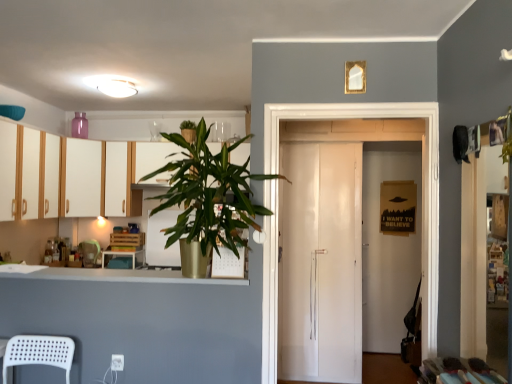
Question: Could you tell me if matte wood table at center is turned towards white glossy refrigerator at center?

Choices:
 (A) yes
 (B) no

Answer: (B)

Question: Considering the relative sizes of matte wood table at center and white glossy refrigerator at center in the image provided, is matte wood table at center shorter than white glossy refrigerator at center?

Choices:
 (A) no
 (B) yes

Answer: (B)

Question: From a real-world perspective, is matte wood table at center over white glossy refrigerator at center?

Choices:
 (A) no
 (B) yes

Answer: (A)

Question: Could white glossy refrigerator at center be considered to be inside matte wood table at center?

Choices:
 (A) no
 (B) yes

Answer: (A)

Question: Does matte wood table at center have a greater height compared to white glossy refrigerator at center?

Choices:
 (A) no
 (B) yes

Answer: (A)

Question: Does point (234, 206) appear closer or farther from the camera than point (118, 198)?

Choices:
 (A) farther
 (B) closer

Answer: (B)

Question: Is green leafy plant at upper center bigger or smaller than matte white cabinet at upper left, the first cabinetry viewed from the back?

Choices:
 (A) big
 (B) small

Answer: (A)

Question: From the image's perspective, is green leafy plant at upper center positioned above or below matte white cabinet at upper left, which ranks as the first cabinetry in left-to-right order?

Choices:
 (A) above
 (B) below

Answer: (B)

Question: Considering their positions, is green leafy plant at upper center located in front of or behind matte white cabinet at upper left, the second cabinetry from the right?

Choices:
 (A) front
 (B) behind

Answer: (A)

Question: From the image's perspective, is white wood cabinets at left, which is the second cabinetry from left to right, positioned above or below matte white cabinet at upper left, which ranks as the first cabinetry in left-to-right order?

Choices:
 (A) below
 (B) above

Answer: (B)

Question: From a real-world perspective, is white wood cabinets at left, the first cabinetry positioned from the right, positioned above or below matte white cabinet at upper left, the first cabinetry viewed from the back?

Choices:
 (A) below
 (B) above

Answer: (B)

Question: Based on their sizes in the image, would you say white wood cabinets at left, acting as the 2th cabinetry starting from the back, is bigger or smaller than matte white cabinet at upper left, which ranks as the first cabinetry in left-to-right order?

Choices:
 (A) big
 (B) small

Answer: (A)

Question: In terms of height, does white wood cabinets at left, the first cabinetry positioned from the right, look taller or shorter compared to matte white cabinet at upper left, the second cabinetry when ordered from front to back?

Choices:
 (A) tall
 (B) short

Answer: (B)

Question: In the image, is green leafy plant at upper center positioned in front of or behind white wood cabinets at left, acting as the first cabinetry starting from the front?

Choices:
 (A) behind
 (B) front

Answer: (B)

Question: From the image's perspective, relative to white wood cabinets at left, the first cabinetry positioned from the right, is green leafy plant at upper center above or below?

Choices:
 (A) below
 (B) above

Answer: (A)